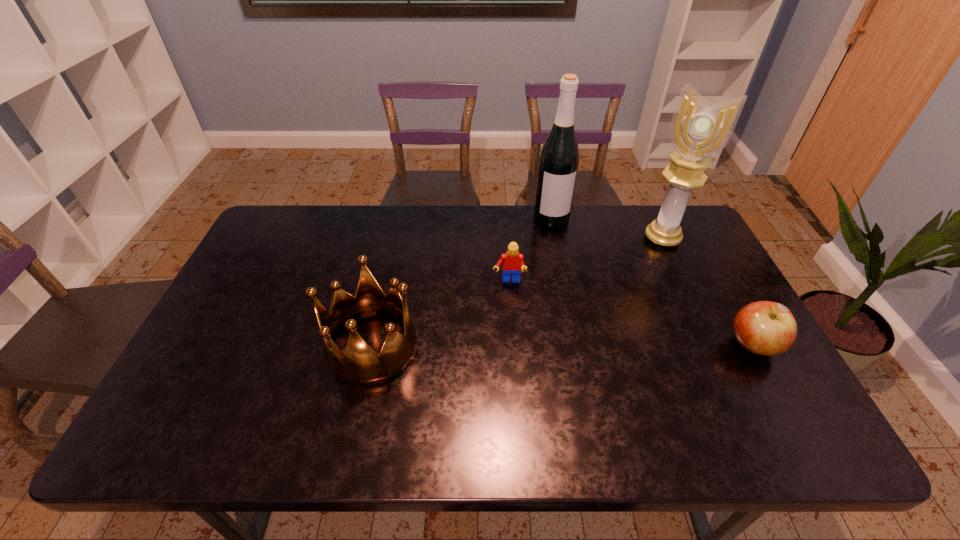
Identify the location of free point that satisfies the following two spatial constraints: 1. on the back side of the third nearest object; 2. on the right side of the third shortest object. (387, 281).